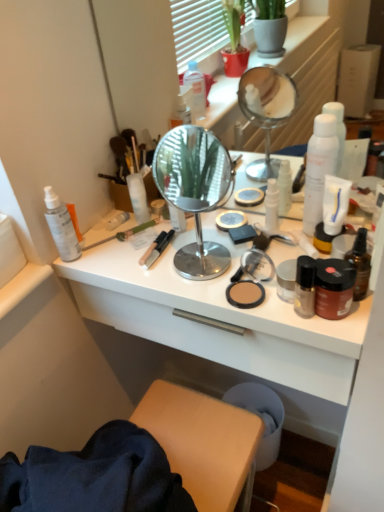
You are a GUI agent. You are given a task and a screenshot of the screen. Output one action in this format:
    pyautogui.click(x=<x>, y=<y>)
    Task: Click on the free space above white glossy desk at center (from a real-world perspective)
    
    Given the screenshot: What is the action you would take?
    pyautogui.click(x=204, y=248)